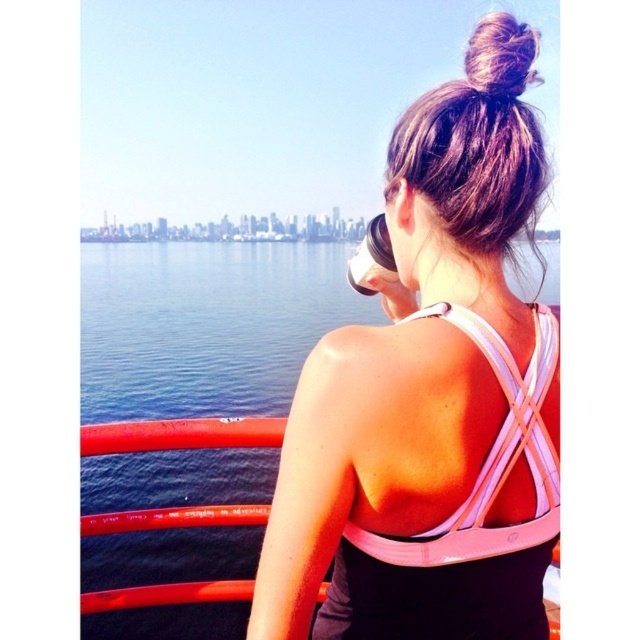
Question: Is blue water at center wider than brown silky hair bun at upper center?

Choices:
 (A) no
 (B) yes

Answer: (B)

Question: Among these points, which one is nearest to the camera?

Choices:
 (A) (467, 58)
 (B) (385, 196)

Answer: (A)

Question: Estimate the real-world distances between objects in this image. Which object is closer to the pink fabric sports bra at upper center?

Choices:
 (A) brown silky hair bun at upper center
 (B) blue water at center

Answer: (A)

Question: Can you confirm if blue water at center is positioned to the right of brown silky hair bun at upper center?

Choices:
 (A) no
 (B) yes

Answer: (A)

Question: Which point appears farthest from the camera in this image?

Choices:
 (A) (224, 468)
 (B) (522, 49)
 (C) (552, 420)

Answer: (A)

Question: Is pink fabric sports bra at upper center wider than brown silky hair bun at upper center?

Choices:
 (A) no
 (B) yes

Answer: (B)